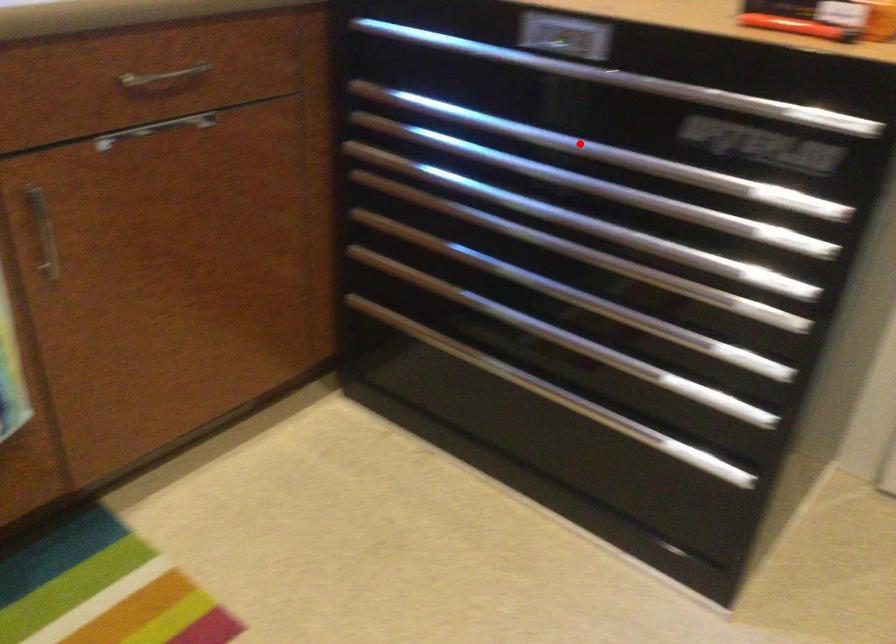
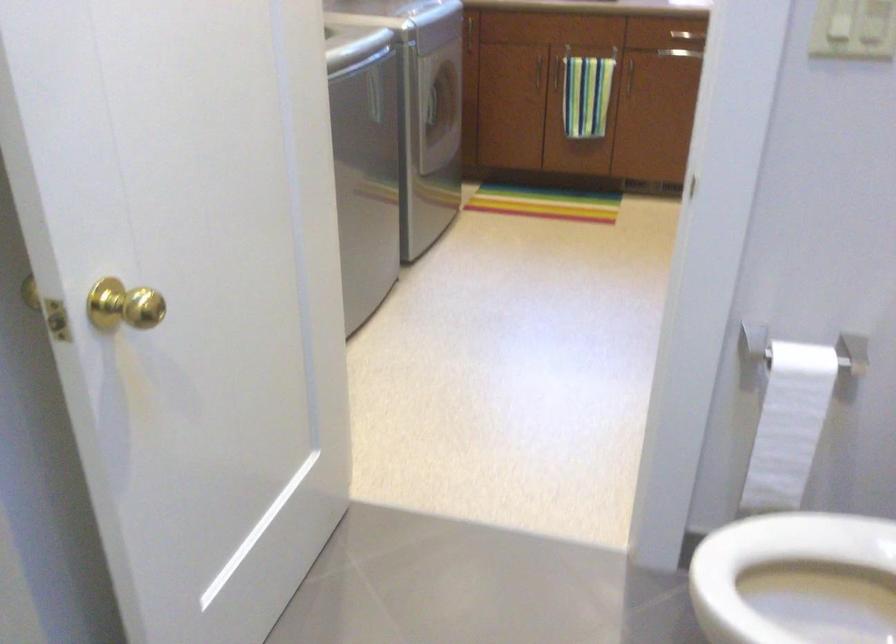
Question: I am providing you with two images of the same scene from different viewpoints. A red point is marked on the first image. Is the red point's position out of view in image 2?

Choices:
 (A) Yes
 (B) No

Answer: (A)